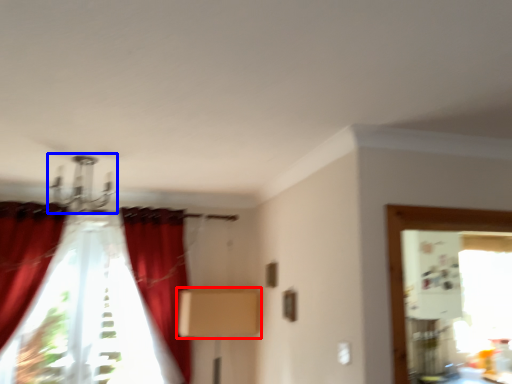
Question: Which point is closer to the camera, cardboard box (highlighted by a red box) or light fixture (highlighted by a blue box)?

Choices:
 (A) cardboard box
 (B) light fixture

Answer: (B)